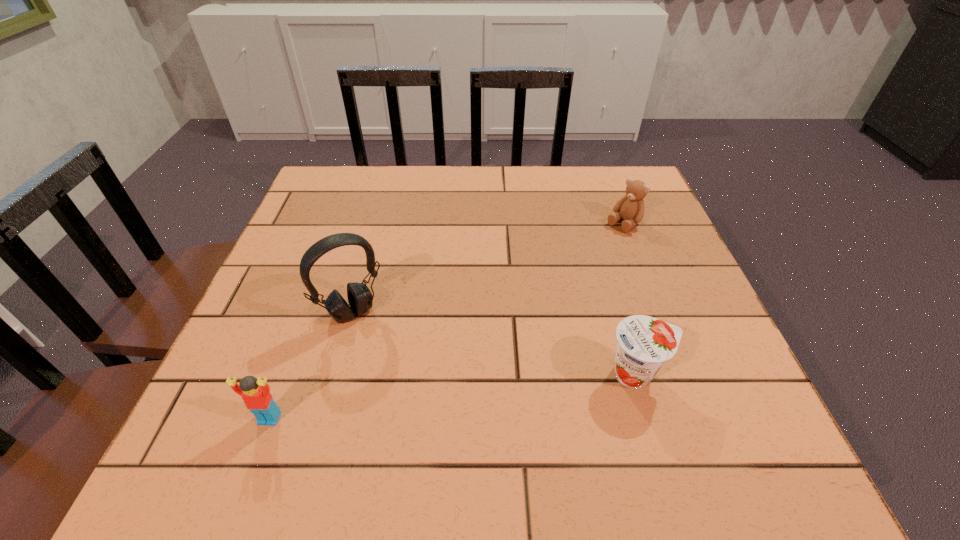
Where is `free space between the second farthest object and the Lego`? The width and height of the screenshot is (960, 540). free space between the second farthest object and the Lego is located at coordinates (311, 365).

The width and height of the screenshot is (960, 540). What are the coordinates of `vacant space that's between the Lego and the tallest object` in the screenshot? It's located at [x=311, y=365].

Where is `free point between the farthest object and the second farthest object`? This screenshot has height=540, width=960. free point between the farthest object and the second farthest object is located at coordinates (488, 268).

I want to click on free point between the tallest object and the nearest object, so click(311, 365).

You are a GUI agent. You are given a task and a screenshot of the screen. Output one action in this format:
    pyautogui.click(x=<x>, y=<y>)
    Task: Click on the vacant area that lies between the tallest object and the teddy bear
    
    Given the screenshot: What is the action you would take?
    pyautogui.click(x=488, y=268)

You are a GUI agent. You are given a task and a screenshot of the screen. Output one action in this format:
    pyautogui.click(x=<x>, y=<y>)
    Task: Click on the free space between the tallest object and the Lego
    The height and width of the screenshot is (540, 960).
    Given the screenshot: What is the action you would take?
    pyautogui.click(x=311, y=365)

The height and width of the screenshot is (540, 960). What are the coordinates of `vacant point located between the teddy bear and the nearest object` in the screenshot? It's located at (446, 321).

Locate which object is the closest to the teddy bear. Please provide its 2D coordinates. Your answer should be formatted as a tuple, i.e. [(x, y)], where the tuple contains the x and y coordinates of a point satisfying the conditions above.

[(644, 344)]

Find the location of a particular element. object that is the closest to the second nearest object is located at coordinates (630, 208).